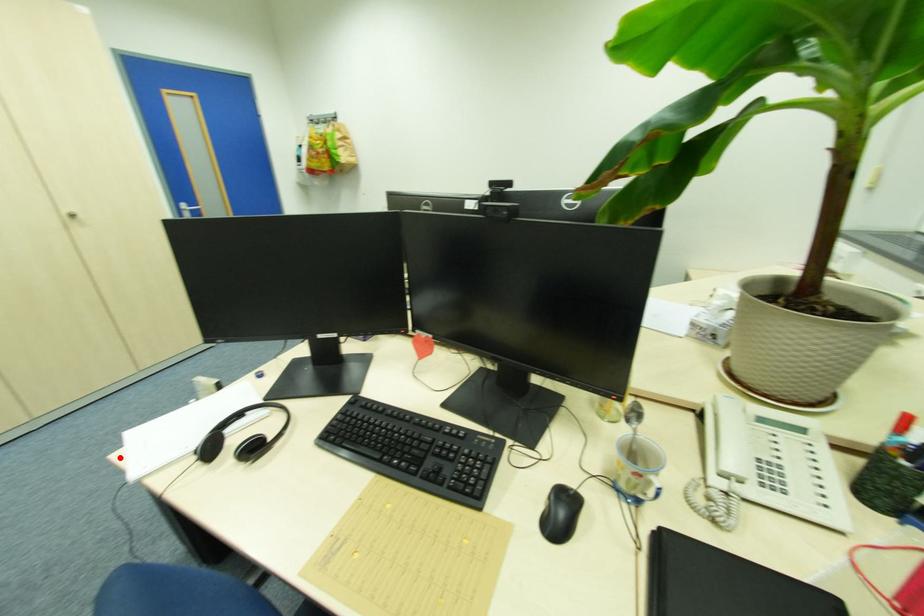
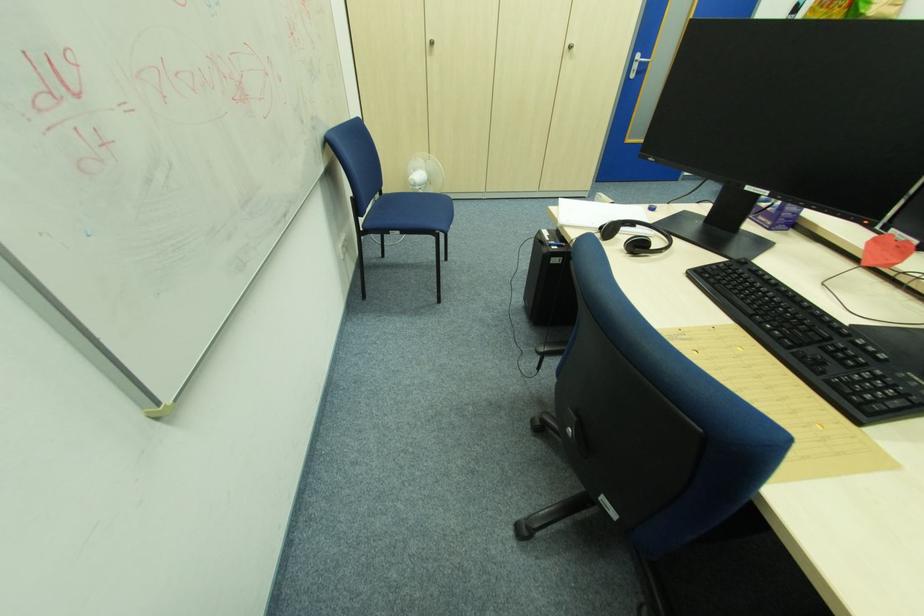
Question: I am providing you with two images of the same scene from different viewpoints. Given a red point in image1, look at the same physical point in image2. Is it:

Choices:
 (A) Closer to the viewpoint
 (B) Farther from the viewpoint

Answer: (A)